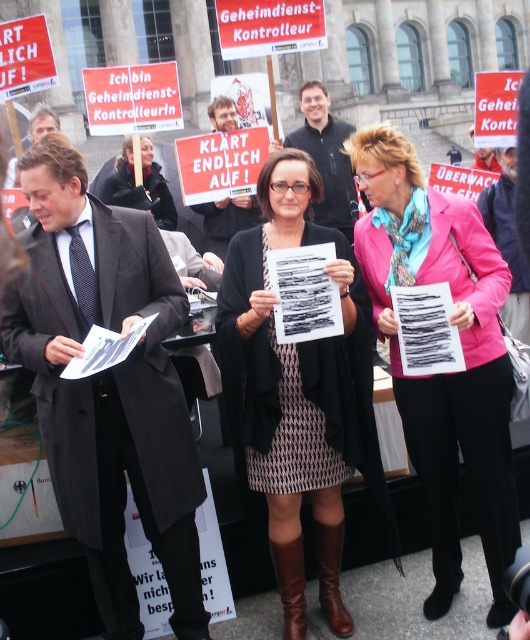
You are a photographer standing in front of the large stone building. You want to take a photo that includes both the point at coordinates point (126, 170) and point (330, 589). Which point should you focus on first to ensure both are in focus?

You should focus on point (126, 170) first because it is closer to you than point (330, 589), ensuring both will be in focus when using a camera with a fixed focal plane.